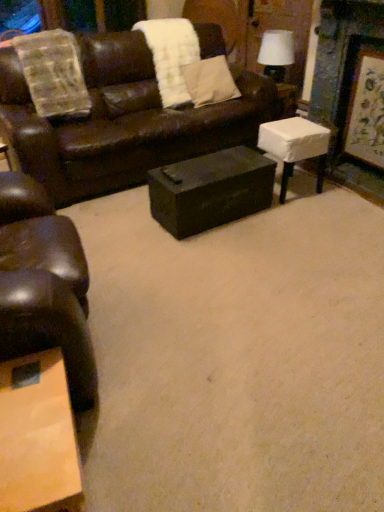
Where is `free space in front of white fabric-covered stool at right, the 1th table viewed from the right`? This screenshot has width=384, height=512. free space in front of white fabric-covered stool at right, the 1th table viewed from the right is located at coordinates (302, 213).